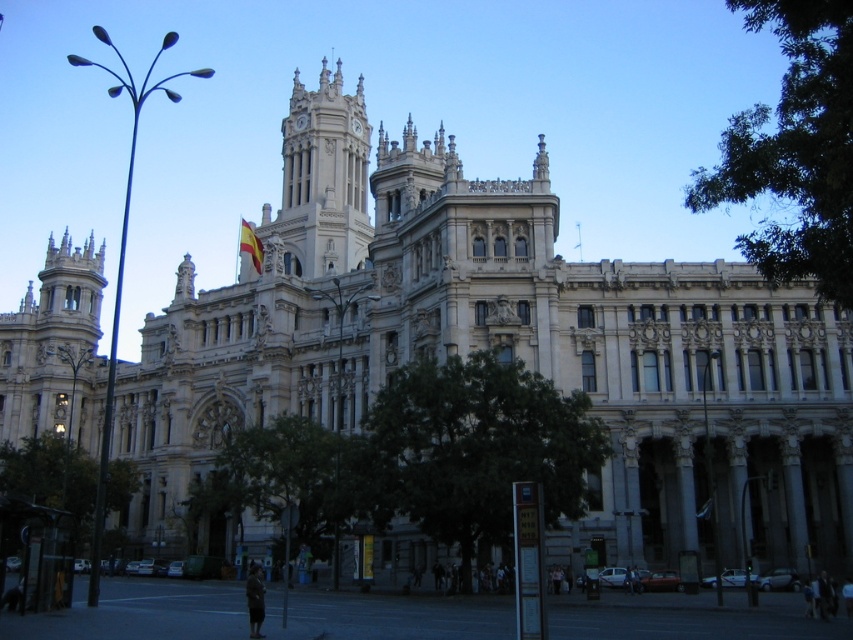
Can you confirm if white stone clock tower at upper center is positioned to the left of yellow-red striped fabric at upper center?

Incorrect, white stone clock tower at upper center is not on the left side of yellow-red striped fabric at upper center.

Is white stone clock tower at upper center positioned behind yellow-red striped fabric at upper center?

Yes, white stone clock tower at upper center is behind yellow-red striped fabric at upper center.

What do you see at coordinates (323, 179) in the screenshot? I see `white stone clock tower at upper center` at bounding box center [323, 179].

At what (x,y) coordinates should I click in order to perform the action: click on white stone clock tower at upper center. Please return your answer as a coordinate pair (x, y). Image resolution: width=853 pixels, height=640 pixels. Looking at the image, I should click on tap(323, 179).